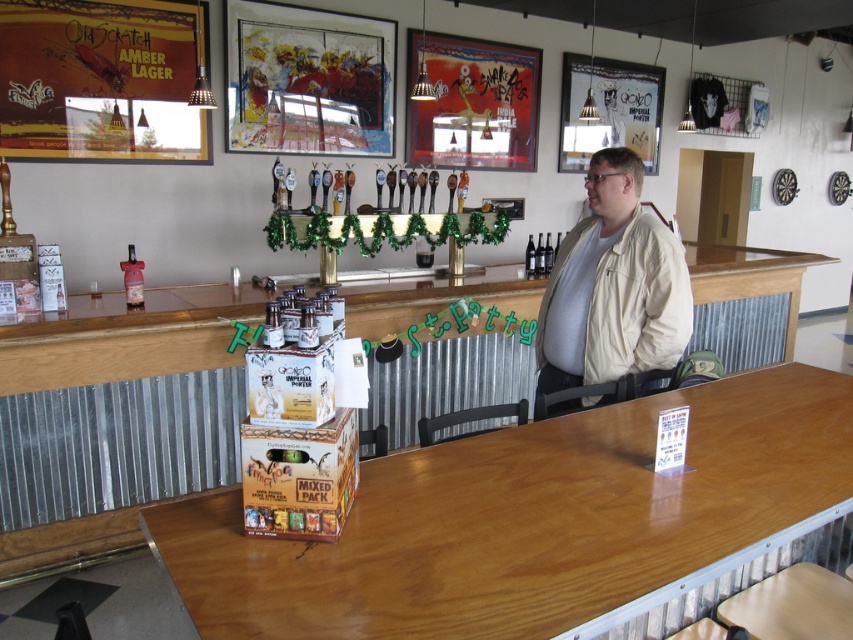
Between matte wooden signboard at upper left and beige leather jacket at center, which one has less height?

beige leather jacket at center is shorter.

You are a GUI agent. You are given a task and a screenshot of the screen. Output one action in this format:
    pyautogui.click(x=<x>, y=<y>)
    Task: Click on the matte wooden signboard at upper left
    The image size is (853, 640).
    Given the screenshot: What is the action you would take?
    pyautogui.click(x=99, y=80)

Is point (59, 108) farther from viewer compared to point (614, 285)?

Yes, it is.

You are a GUI agent. You are given a task and a screenshot of the screen. Output one action in this format:
    pyautogui.click(x=<x>, y=<y>)
    Task: Click on the matte wooden signboard at upper left
    Image resolution: width=853 pixels, height=640 pixels.
    Given the screenshot: What is the action you would take?
    pyautogui.click(x=99, y=80)

Is wooden table at center behind brown cardboard mixed pack at center?

No.

Is point (538, 588) positioned before point (305, 515)?

Yes, it is in front of point (305, 515).

This screenshot has height=640, width=853. Find the location of `wooden table at center`. wooden table at center is located at coordinates (532, 522).

How distant is beige leather jacket at center from brown cardboard mixed pack at center?

A distance of 4.50 feet exists between beige leather jacket at center and brown cardboard mixed pack at center.

Can you confirm if beige leather jacket at center is thinner than brown cardboard mixed pack at center?

In fact, beige leather jacket at center might be wider than brown cardboard mixed pack at center.

Who is more forward, (641, 243) or (357, 470)?

Point (357, 470) is in front.

The width and height of the screenshot is (853, 640). I want to click on beige leather jacket at center, so click(613, 285).